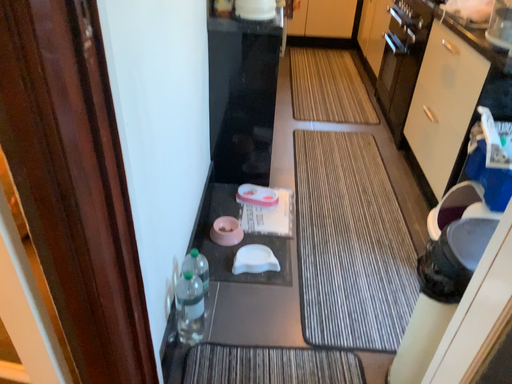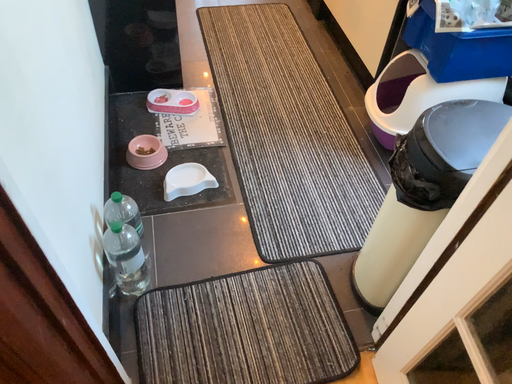
Question: Which way did the camera rotate in the video?

Choices:
 (A) rotated right
 (B) rotated left

Answer: (A)